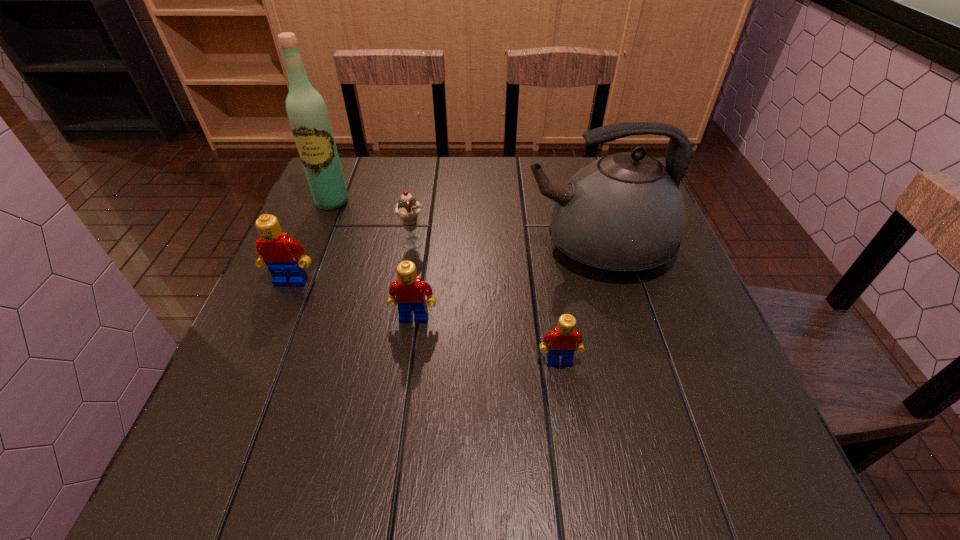
In order to click on the farthest Lego in this screenshot , I will do `click(276, 249)`.

I want to click on the second Lego from left to right, so click(x=409, y=292).

I want to click on the second nearest Lego, so click(409, 292).

Where is `the rightmost Lego`? This screenshot has height=540, width=960. the rightmost Lego is located at coordinates (563, 341).

You are a GUI agent. You are given a task and a screenshot of the screen. Output one action in this format:
    pyautogui.click(x=<x>, y=<y>)
    Task: Click on the nearest object
    
    Given the screenshot: What is the action you would take?
    pyautogui.click(x=563, y=341)

Where is `the farthest object`? the farthest object is located at coordinates (308, 116).

Locate an element on the screen. the tallest object is located at coordinates (308, 116).

This screenshot has height=540, width=960. What are the coordinates of `the fifth shortest object` in the screenshot? It's located at (624, 213).

Where is `icecream`? The image size is (960, 540). icecream is located at coordinates (408, 210).

Where is `vacant space located on the front-facing side of the leftmost Lego`? The image size is (960, 540). vacant space located on the front-facing side of the leftmost Lego is located at coordinates (281, 306).